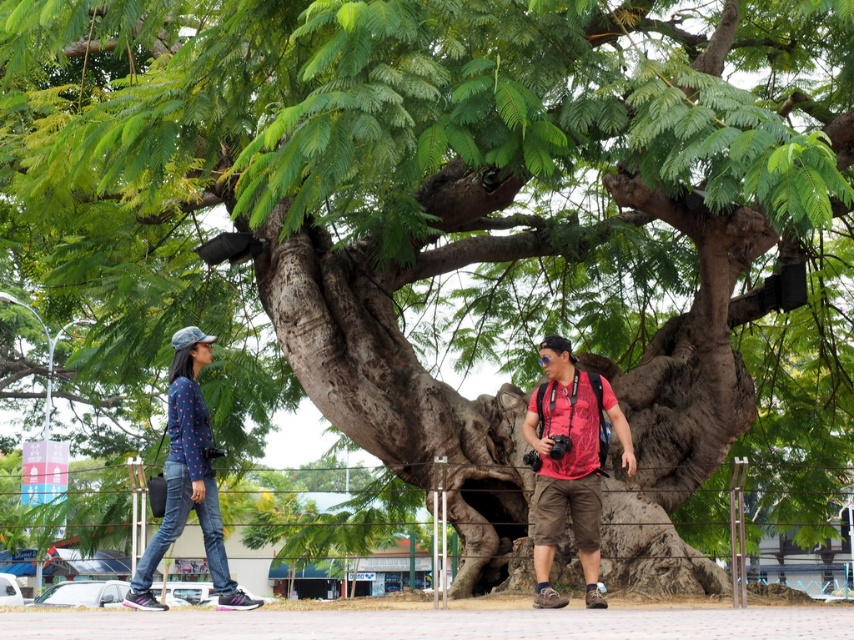
Is matte red shirt at center smaller than denim jeans at left?

Yes.

Does matte red shirt at center have a lesser height compared to denim jeans at left?

Indeed, matte red shirt at center has a lesser height compared to denim jeans at left.

The width and height of the screenshot is (854, 640). I want to click on matte red shirt at center, so click(569, 465).

This screenshot has height=640, width=854. In order to click on matte red shirt at center in this screenshot , I will do `click(569, 465)`.